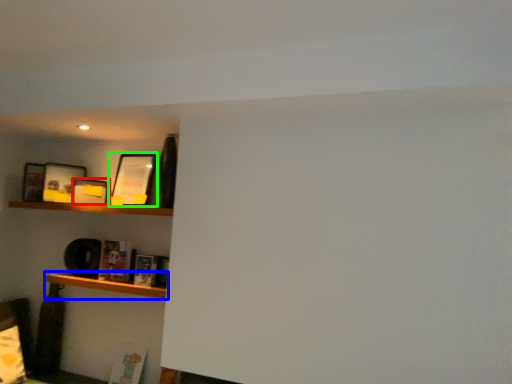
Question: Which object is positioned farthest from picture frame (highlighted by a red box)? Select from shelf (highlighted by a blue box) and picture frame (highlighted by a green box).

Choices:
 (A) shelf
 (B) picture frame

Answer: (A)